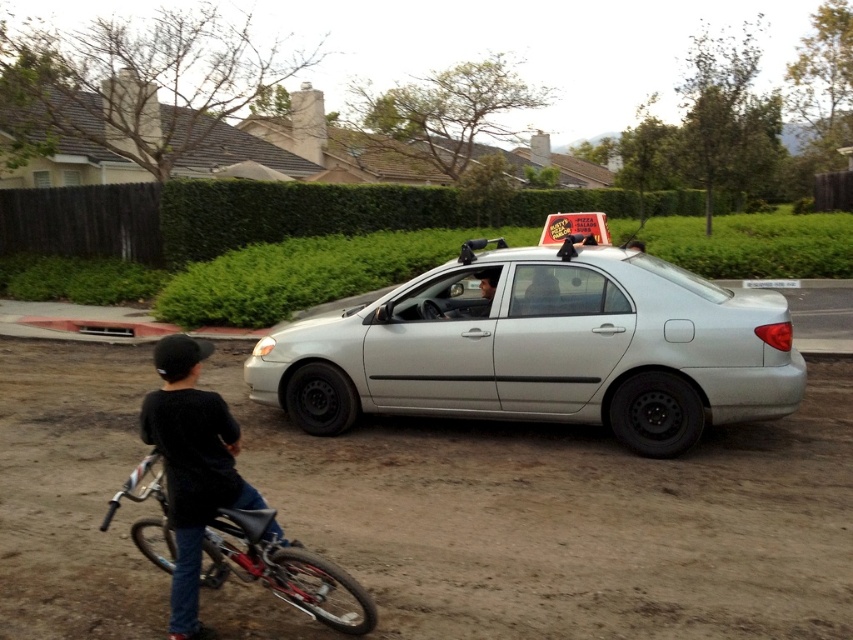
Can you confirm if silver metallic sedan at center is wider than black matte shirt at lower left?

Indeed, silver metallic sedan at center has a greater width compared to black matte shirt at lower left.

Is silver metallic sedan at center below black matte shirt at lower left?

Actually, silver metallic sedan at center is above black matte shirt at lower left.

At what (x,y) coordinates should I click in order to perform the action: click on silver metallic sedan at center. Please return your answer as a coordinate pair (x, y). This screenshot has width=853, height=640. Looking at the image, I should click on (543, 348).

At what (x,y) coordinates should I click in order to perform the action: click on silver metallic sedan at center. Please return your answer as a coordinate pair (x, y). Looking at the image, I should click on (543, 348).

Who is positioned more to the right, dirt track at lower left or white plastic license plate at center?

white plastic license plate at center

Is dirt track at lower left wider than white plastic license plate at center?

No.

Is point (210, 360) in front of point (770, 280)?

Yes, it is.

Identify the location of dirt track at lower left. (572, 520).

Between dirt track at lower left and reddish metallic bicycle at lower left, which one has less height?

dirt track at lower left is shorter.

Who is higher up, dirt track at lower left or reddish metallic bicycle at lower left?

reddish metallic bicycle at lower left is above.

The image size is (853, 640). I want to click on dirt track at lower left, so click(x=572, y=520).